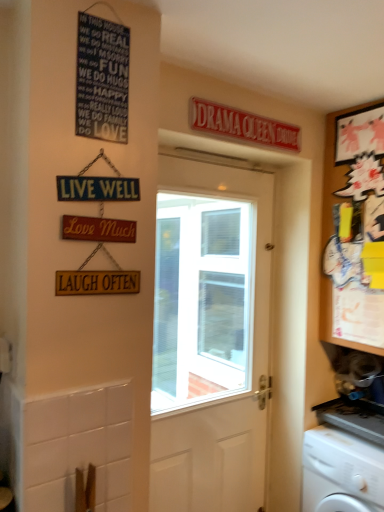
Question: Should I look upward or downward to see wooden cabinet at right?

Choices:
 (A) down
 (B) up

Answer: (B)

Question: Considering the relative positions of matte black signboard at upper left and white plastic washing machine at lower right in the image provided, is matte black signboard at upper left in front of white plastic washing machine at lower right?

Choices:
 (A) yes
 (B) no

Answer: (A)

Question: Considering the relative sizes of matte black signboard at upper left and white plastic washing machine at lower right in the image provided, is matte black signboard at upper left thinner than white plastic washing machine at lower right?

Choices:
 (A) yes
 (B) no

Answer: (A)

Question: Is white plastic washing machine at lower right at the back of matte black signboard at upper left?

Choices:
 (A) yes
 (B) no

Answer: (B)

Question: Would you say matte black signboard at upper left is outside white plastic washing machine at lower right?

Choices:
 (A) no
 (B) yes

Answer: (B)

Question: From the image's perspective, is matte black signboard at upper left below white plastic washing machine at lower right?

Choices:
 (A) no
 (B) yes

Answer: (A)

Question: Can you confirm if matte black signboard at upper left is shorter than white plastic washing machine at lower right?

Choices:
 (A) yes
 (B) no

Answer: (A)

Question: Is wooden signboard at center-left looking in the opposite direction of white plastic washing machine at lower right?

Choices:
 (A) yes
 (B) no

Answer: (B)

Question: Can you confirm if wooden signboard at center-left is thinner than white plastic washing machine at lower right?

Choices:
 (A) yes
 (B) no

Answer: (A)

Question: Considering the relative sizes of wooden signboard at center-left and white plastic washing machine at lower right in the image provided, is wooden signboard at center-left smaller than white plastic washing machine at lower right?

Choices:
 (A) no
 (B) yes

Answer: (B)

Question: From a real-world perspective, is wooden signboard at center-left located beneath white plastic washing machine at lower right?

Choices:
 (A) no
 (B) yes

Answer: (A)

Question: Is wooden signboard at center-left located outside white plastic washing machine at lower right?

Choices:
 (A) no
 (B) yes

Answer: (B)

Question: Is wooden signboard at center-left at the right side of white plastic washing machine at lower right?

Choices:
 (A) yes
 (B) no

Answer: (B)

Question: Does matte black signboard at upper left have a larger size compared to wooden cabinet at right?

Choices:
 (A) no
 (B) yes

Answer: (A)